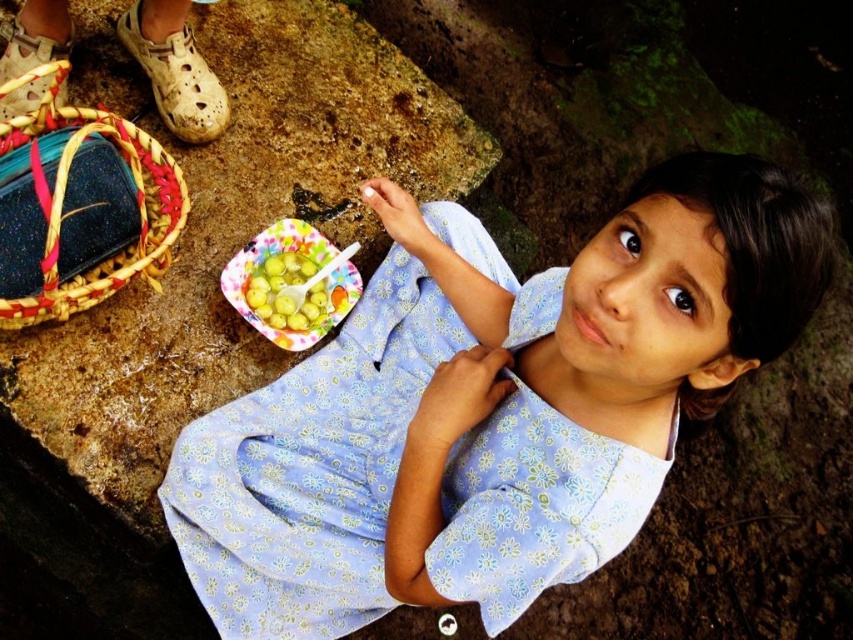
Which is behind, point (4, 321) or point (326, 262)?

Point (326, 262)

Is woven straw basket at lower left bigger than green matte fruit at center?

Indeed, woven straw basket at lower left has a larger size compared to green matte fruit at center.

At what (x,y) coordinates should I click in order to perform the action: click on woven straw basket at lower left. Please return your answer as a coordinate pair (x, y). The width and height of the screenshot is (853, 640). Looking at the image, I should click on (138, 209).

Does colorful paper plate at center have a greater height compared to green matte fruit at center?

Yes.

Who is shorter, colorful paper plate at center or green matte fruit at center?

Standing shorter between the two is green matte fruit at center.

Which is behind, point (264, 332) or point (312, 305)?

The point (312, 305) is more distant.

You are a GUI agent. You are given a task and a screenshot of the screen. Output one action in this format:
    pyautogui.click(x=<x>, y=<y>)
    Task: Click on the colorful paper plate at center
    The width and height of the screenshot is (853, 640).
    Given the screenshot: What is the action you would take?
    pyautogui.click(x=263, y=259)

From the picture: Is blue floral fabric dress at center closer to the viewer compared to green matte fruit at center?

Yes, blue floral fabric dress at center is in front of green matte fruit at center.

Between point (602, 454) and point (257, 291), which one is positioned behind?

The point (257, 291) is behind.

Measure the distance between blue floral fabric dress at center and camera.

A distance of 1.04 meters exists between blue floral fabric dress at center and camera.

I want to click on blue floral fabric dress at center, so click(310, 468).